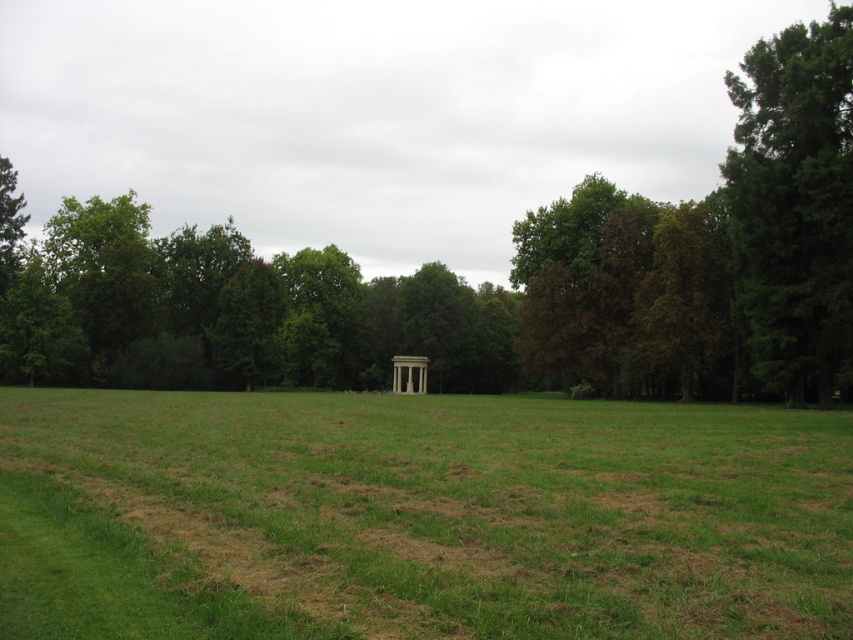
In the scene shown: You are planning to place a new bench in the field. The bench is as wide as the white marble gazebo at center. If you want to place it near the green coniferous tree at right without overlapping, which direction should you move it?

Since the green coniferous tree at right is wider than the white marble gazebo at center, you should move the bench to the left side of the green coniferous tree at right to avoid overlapping.

Based on the coordinates provided, which object in the scene is located at point (418,516)?

The green grassy field at center is located at point (418,516).